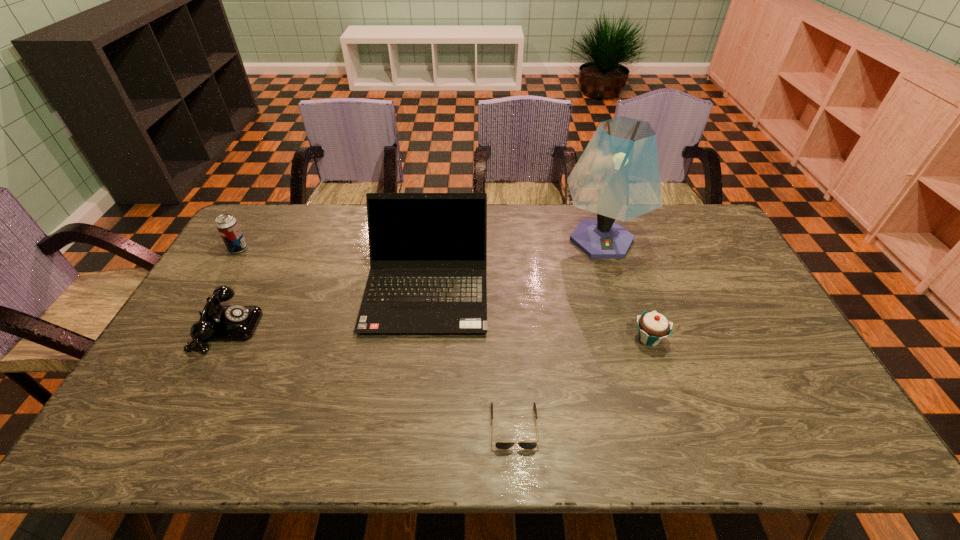
The height and width of the screenshot is (540, 960). I want to click on vacant space located on the right of the fourth shortest object, so click(271, 249).

Locate an element on the screen. The height and width of the screenshot is (540, 960). vacant space located on the right of the cupcake is located at coordinates point(723,339).

Locate an element on the screen. The image size is (960, 540). free region located on the dial of the telephone is located at coordinates click(351, 328).

Locate an element on the screen. This screenshot has height=540, width=960. lampshade that is at the far edge is located at coordinates (617, 176).

Locate an element on the screen. This screenshot has height=540, width=960. beer can positioned at the far edge is located at coordinates (228, 227).

At what (x,y) coordinates should I click in order to perform the action: click on object present at the near edge. Please return your answer as a coordinate pair (x, y). This screenshot has height=540, width=960. Looking at the image, I should click on (499, 445).

Find the location of a particular element. This screenshot has height=540, width=960. beer can present at the left edge is located at coordinates 228,227.

Where is `telephone at the left edge`? Image resolution: width=960 pixels, height=540 pixels. telephone at the left edge is located at coordinates (217, 322).

This screenshot has height=540, width=960. I want to click on object that is at the far left corner, so click(x=228, y=227).

This screenshot has height=540, width=960. What are the coordinates of `vacant space at the far edge of the desktop` in the screenshot? It's located at (356, 230).